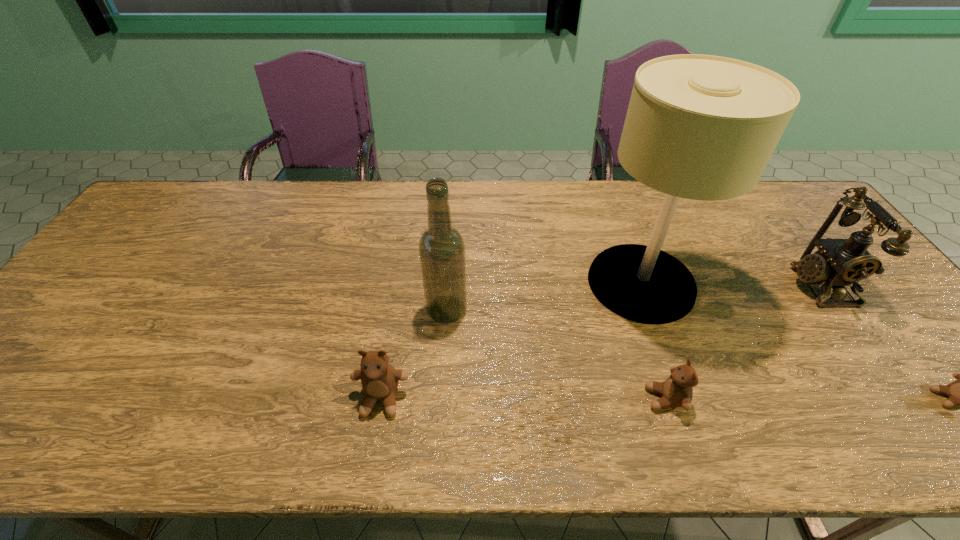
Find the location of a particular element. This screenshot has height=540, width=960. free spot at the right edge of the desktop is located at coordinates (917, 359).

Where is `blank space at the near left corner of the desktop`? The height and width of the screenshot is (540, 960). blank space at the near left corner of the desktop is located at coordinates (20, 383).

The width and height of the screenshot is (960, 540). What are the coordinates of `empty space that is in between the fifth shortest object and the tallest object` in the screenshot? It's located at (544, 296).

The width and height of the screenshot is (960, 540). In order to click on free spot between the tallest object and the second tallest object in this screenshot , I will do `click(544, 296)`.

You are a GUI agent. You are given a task and a screenshot of the screen. Output one action in this format:
    pyautogui.click(x=<x>, y=<y>)
    Task: Click on the vacant space that's between the second shortest teddy bear and the fourth shortest object
    
    Given the screenshot: What is the action you would take?
    pyautogui.click(x=742, y=341)

Find the location of `vacant region between the liquor and the second shortest object`. vacant region between the liquor and the second shortest object is located at coordinates (556, 354).

I want to click on vacant space that's between the second tallest teddy bear and the telephone, so click(x=742, y=341).

The image size is (960, 540). Find the location of `empty location between the leftmost object and the second teddy bear from right to left`. empty location between the leftmost object and the second teddy bear from right to left is located at coordinates (523, 399).

Locate an element on the screen. This screenshot has width=960, height=540. vacant point located between the table lamp and the third shortest object is located at coordinates (x=511, y=341).

The image size is (960, 540). What are the coordinates of `object that is the closest to the leftmost teddy bear` in the screenshot? It's located at pyautogui.click(x=441, y=248).